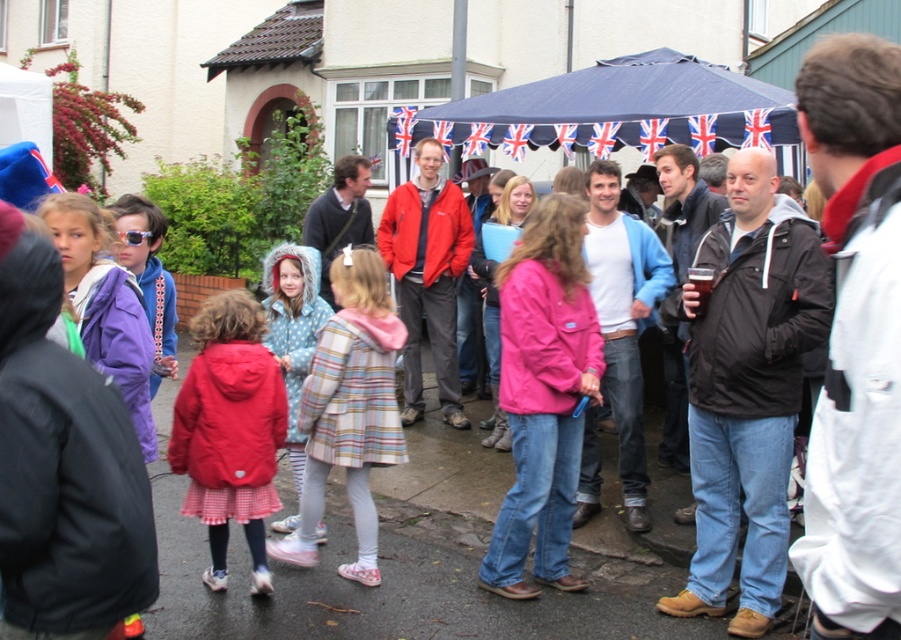
You are a photographer at the event and want to capture a photo of the matte red jacket at center without the blue fabric canopy at center blocking it. How should you adjust your position?

To avoid the blue fabric canopy at center blocking the matte red jacket at center, move to a position where you can tilt your camera upwards or shift your angle so that the canopy is no longer in the line of sight of the jacket.

You are standing at the origin point of the coordinate system in the image. The image has a coordinate system where the bottom left corner is the origin point. The X axis goes from left to right, and the Y axis goes from bottom to top. You need to walk to the matte red jacket at center. In which direction should you move first?

The matte red jacket at center is located at coordinate point 0.673 on the X axis and 0.256 on the Y axis. Since you are at the origin point, which is the bottom left corner, you should first move to the right along the X axis to increase your X coordinate towards 0.673 before adjusting your Y coordinate. However, since the Y coordinate of the jacket is 0.256, which is slightly above the bottom edge, you might also need to move upward slightly. But since the question asks for the first direction, moving to